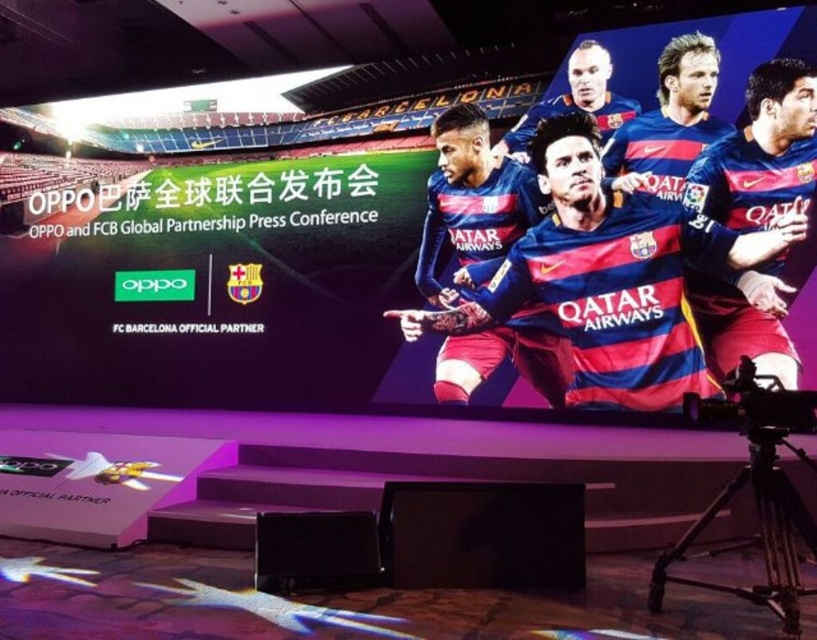
Question: Which of the following is the farthest from the observer?

Choices:
 (A) blue jersey at upper right
 (B) blue jersey at upper center
 (C) blue fabric jersey at upper center
 (D) black matte tripod at lower right

Answer: (C)

Question: Is blue jersey at center to the right of blue jersey at upper center from the viewer's perspective?

Choices:
 (A) no
 (B) yes

Answer: (B)

Question: Is blue fabric jersey at upper center to the right of blue jersey at center from the viewer's perspective?

Choices:
 (A) yes
 (B) no

Answer: (B)

Question: Which of these objects is positioned closest to the blue jersey at upper center?

Choices:
 (A) black matte tripod at lower right
 (B) blue jersey at upper right
 (C) blue jersey at center
 (D) blue striped jersey at upper right

Answer: (D)

Question: Which point appears farthest from the camera in this image?

Choices:
 (A) (588, 93)
 (B) (757, 502)

Answer: (A)

Question: Is blue striped jersey at upper right smaller than blue fabric jersey at center?

Choices:
 (A) no
 (B) yes

Answer: (A)